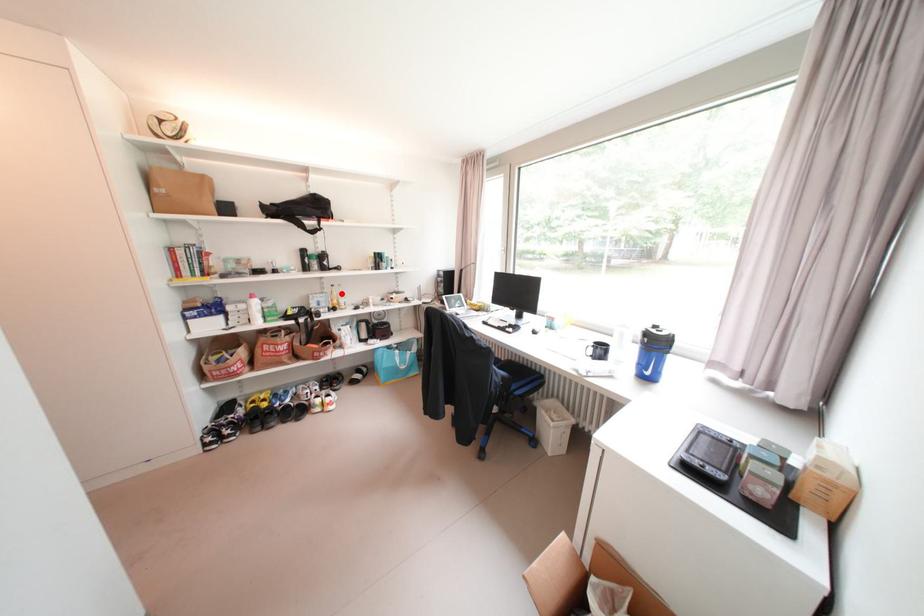
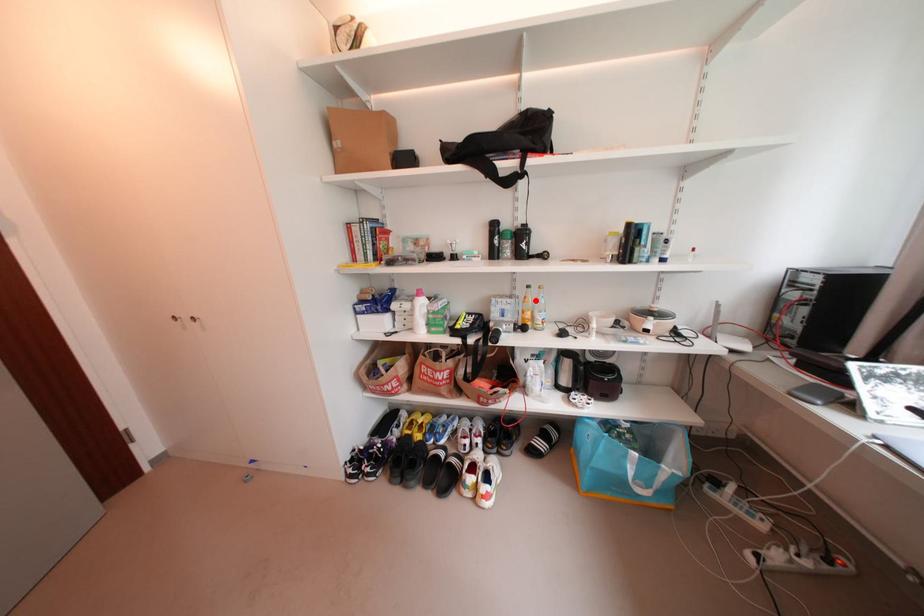
I am providing you with two images of the same scene from different viewpoints. A red point is marked on the first image and another point is marked on the second image. Are the points marked in image1 and image2 representing the same 3D position?

Yes